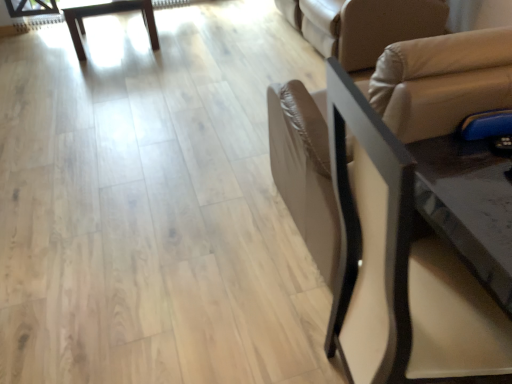
Locate an element on the screen. This screenshot has width=512, height=384. vacant point to the left of wooden table at upper left is located at coordinates (36, 50).